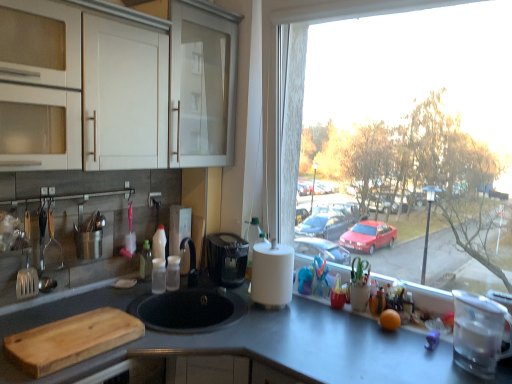
The image size is (512, 384). Find the location of `vacant space to the left of transparent glass water filter at right, the 1th appliance from the right`. vacant space to the left of transparent glass water filter at right, the 1th appliance from the right is located at coordinates (419, 363).